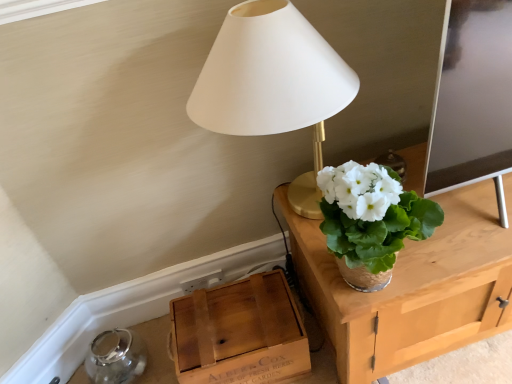
Where is `free space above wooden crate at lower left (from a real-world perspective)`? The image size is (512, 384). free space above wooden crate at lower left (from a real-world perspective) is located at coordinates (239, 315).